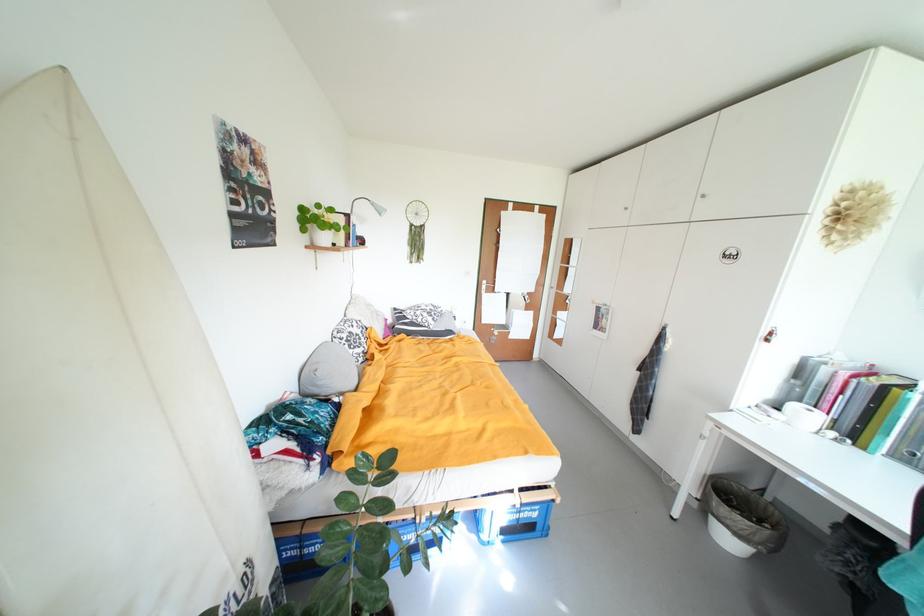
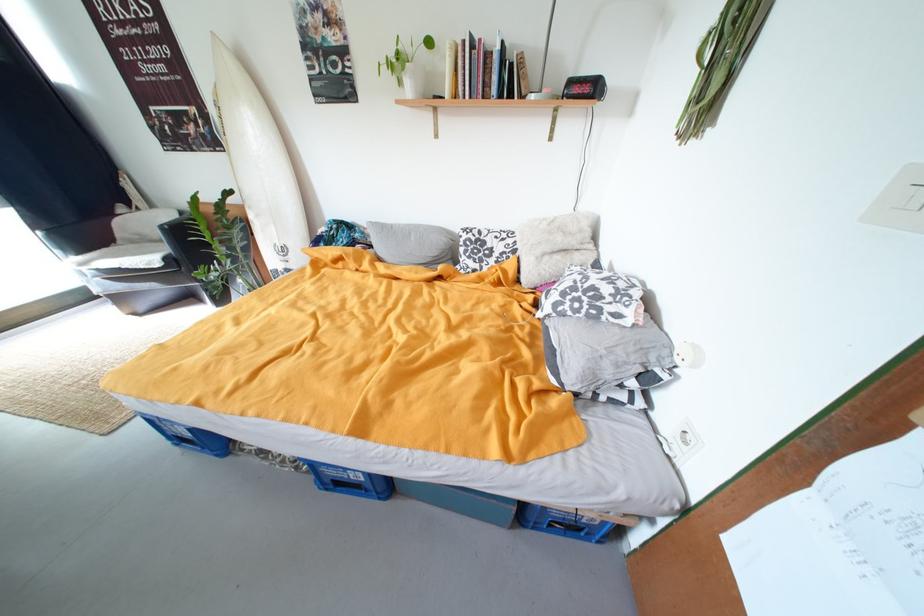
Where in the second image is the point corresponding to (x=442, y=322) from the first image?

(564, 306)